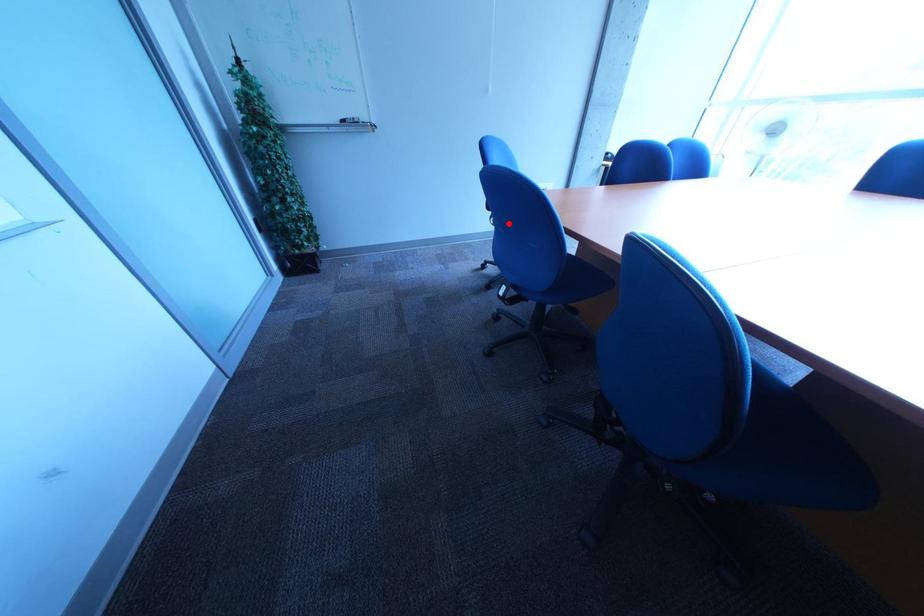
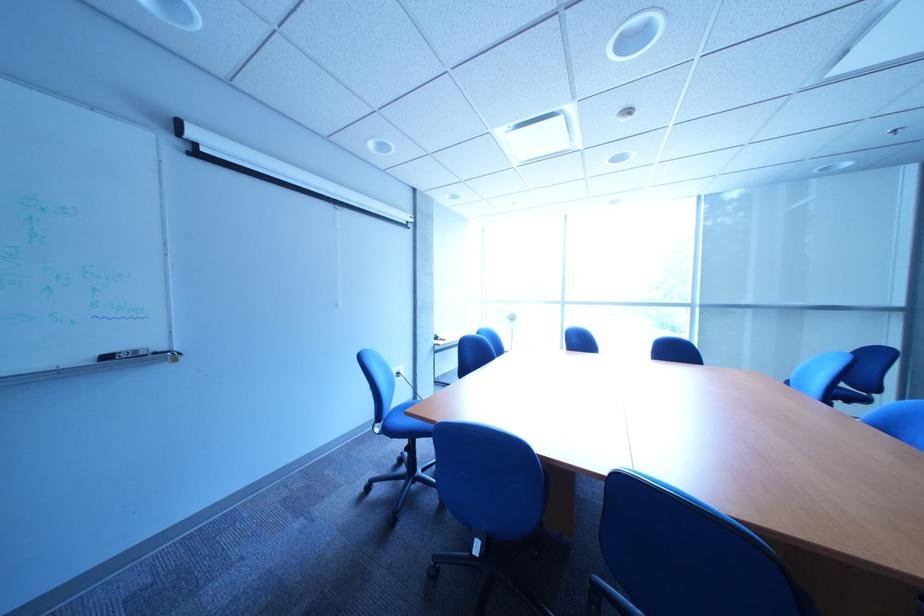
Question: I am providing you with two images of the same scene from different viewpoints. In image1, a red point is highlighted. Considering the same 3D point in image2, which of the following is correct?

Choices:
 (A) It is closer
 (B) It is farther

Answer: (A)